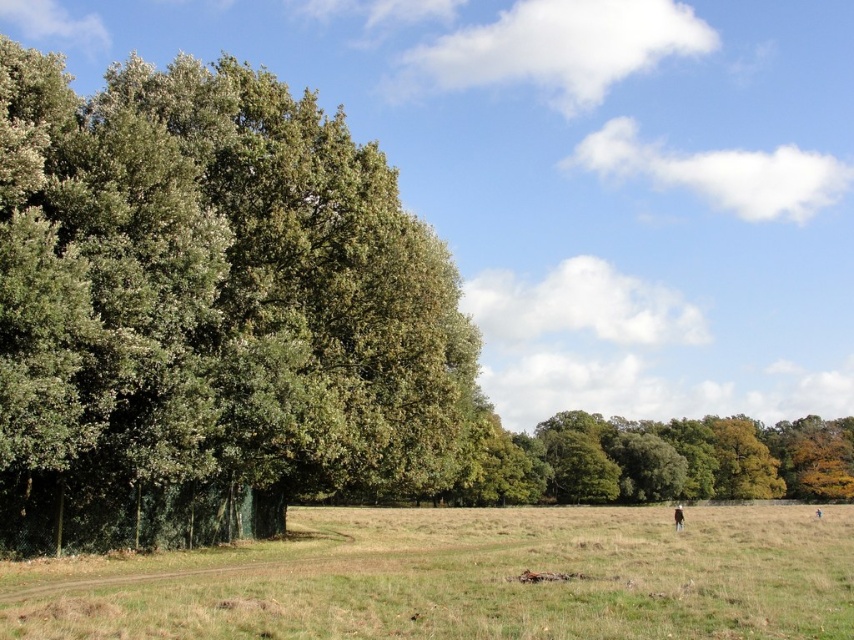
Question: Among these points, which one is nearest to the camera?

Choices:
 (A) (297, 582)
 (B) (674, 524)

Answer: (A)

Question: Is the position of green grass at lower center more distant than that of green leafy trees at center?

Choices:
 (A) yes
 (B) no

Answer: (B)

Question: Can you confirm if green leafy tree at left is positioned to the left of green leafy trees at center?

Choices:
 (A) no
 (B) yes

Answer: (B)

Question: Can you confirm if green grass at lower center is positioned to the left of brown woolen coat at lower right?

Choices:
 (A) no
 (B) yes

Answer: (B)

Question: Which point appears farthest from the camera in this image?

Choices:
 (A) (186, 577)
 (B) (519, 480)
 (C) (12, 365)
 (D) (677, 508)

Answer: (B)

Question: Which object is the farthest from the green leafy tree at left?

Choices:
 (A) green leafy trees at center
 (B) brown woolen coat at lower right

Answer: (A)